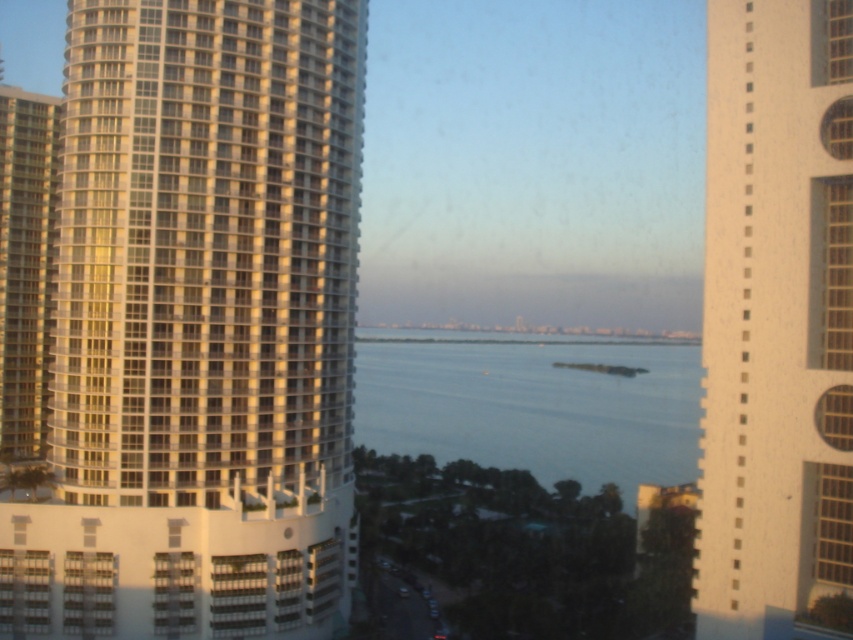
Question: Can you confirm if white glass building at left is wider than white textured building at right?

Choices:
 (A) no
 (B) yes

Answer: (B)

Question: Can you confirm if matte glass windows at left is positioned above clear glass windows at right?

Choices:
 (A) yes
 (B) no

Answer: (B)

Question: Does white textured building at right appear over matte glass windows at left?

Choices:
 (A) yes
 (B) no

Answer: (A)

Question: Which object appears closest to the camera in this image?

Choices:
 (A) white textured building at right
 (B) clear glass windows at right
 (C) matte glass windows at left

Answer: (A)

Question: Which point is farther to the camera?

Choices:
 (A) (827, 253)
 (B) (846, 323)

Answer: (A)

Question: Which point is closer to the camera taking this photo?

Choices:
 (A) (845, 339)
 (B) (828, 525)
 (C) (813, 264)
 (D) (228, 218)

Answer: (A)